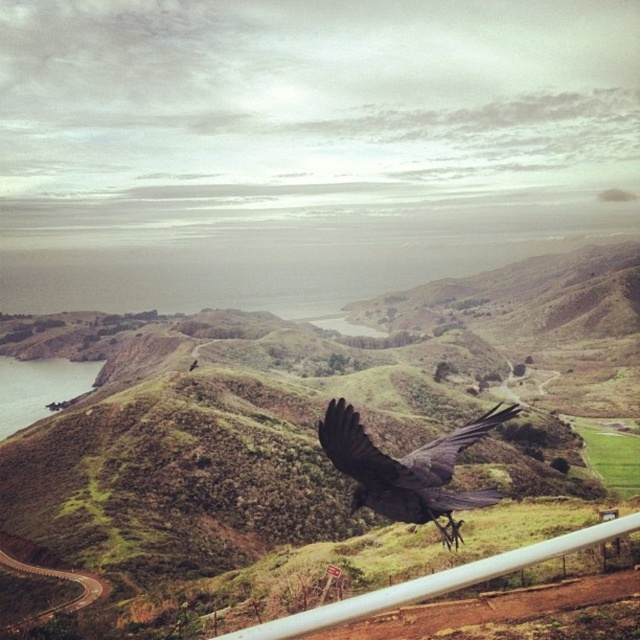
Question: Is shiny black crow at center above white plastic fence at lower right?

Choices:
 (A) yes
 (B) no

Answer: (A)

Question: Can you confirm if green grassy hillside at center is positioned above white plastic fence at lower right?

Choices:
 (A) no
 (B) yes

Answer: (B)

Question: Estimate the real-world distances between objects in this image. Which object is closer to the white plastic fence at lower right?

Choices:
 (A) green grassy hillside at center
 (B) shiny black crow at center

Answer: (B)

Question: Considering the relative positions of green grassy hillside at center and white plastic fence at lower right in the image provided, where is green grassy hillside at center located with respect to white plastic fence at lower right?

Choices:
 (A) above
 (B) below

Answer: (A)

Question: Considering the real-world distances, which object is closest to the white plastic fence at lower right?

Choices:
 (A) shiny black crow at center
 (B) green grassy hillside at center

Answer: (A)

Question: Among these objects, which one is nearest to the camera?

Choices:
 (A) white plastic fence at lower right
 (B) shiny black crow at center
 (C) green grassy hillside at center

Answer: (A)